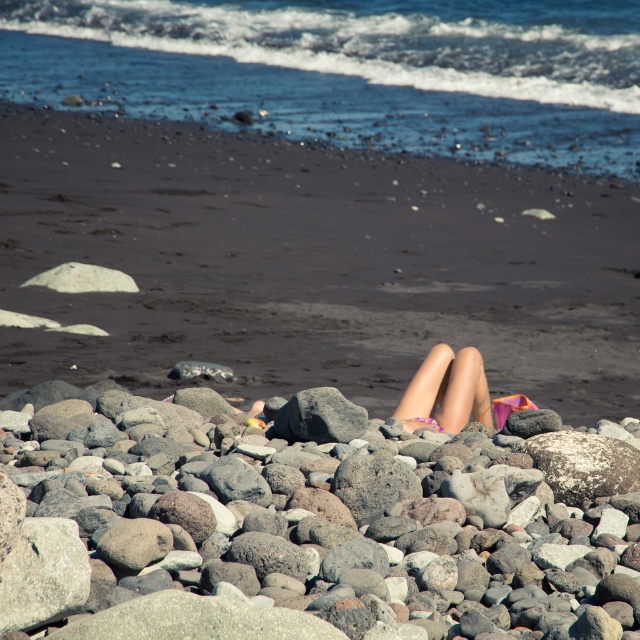
Is smooth sand at center thinner than pink fabric legs at center?

Incorrect, smooth sand at center's width is not less than pink fabric legs at center's.

Does smooth sand at center have a larger size compared to pink fabric legs at center?

Yes.

Who is more distant from viewer, (x=413, y=269) or (x=416, y=410)?

The point (x=413, y=269) is behind.

This screenshot has width=640, height=640. What are the coordinates of `smooth sand at center` in the screenshot? It's located at (310, 266).

Locate an element on the screen. pink fabric legs at center is located at coordinates (445, 392).

Does pink fabric legs at center have a greater width compared to gray rock at center?

Yes, pink fabric legs at center is wider than gray rock at center.

Is point (451, 365) positioned in front of point (316, 426)?

No.

At what (x,y) coordinates should I click in order to perform the action: click on pink fabric legs at center. Please return your answer as a coordinate pair (x, y). Image resolution: width=640 pixels, height=640 pixels. Looking at the image, I should click on (445, 392).

Between smooth sand at center and gray rough rock at lower center, which one has less height?

With less height is gray rough rock at lower center.

In the scene shown: Does smooth sand at center appear over gray rough rock at lower center?

Indeed, smooth sand at center is positioned over gray rough rock at lower center.

Which is behind, point (618, 209) or point (257, 516)?

Positioned behind is point (618, 209).

Find the location of `smooth sand at center`. smooth sand at center is located at coordinates (310, 266).